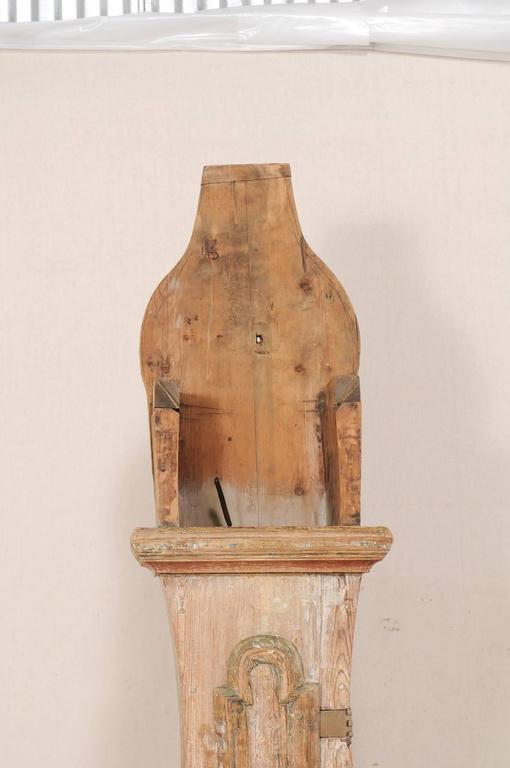
I want to click on flat platform area of wood, so click(259, 525).